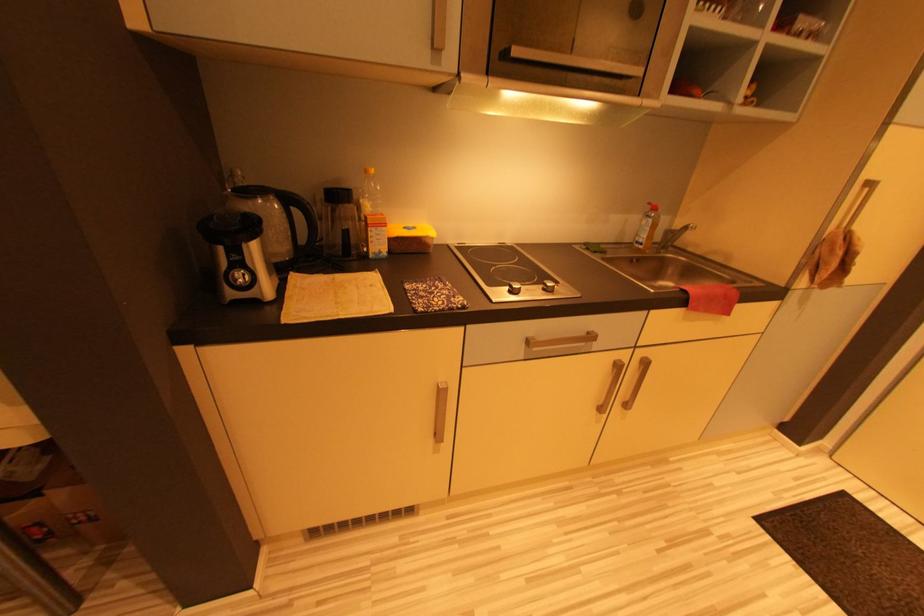
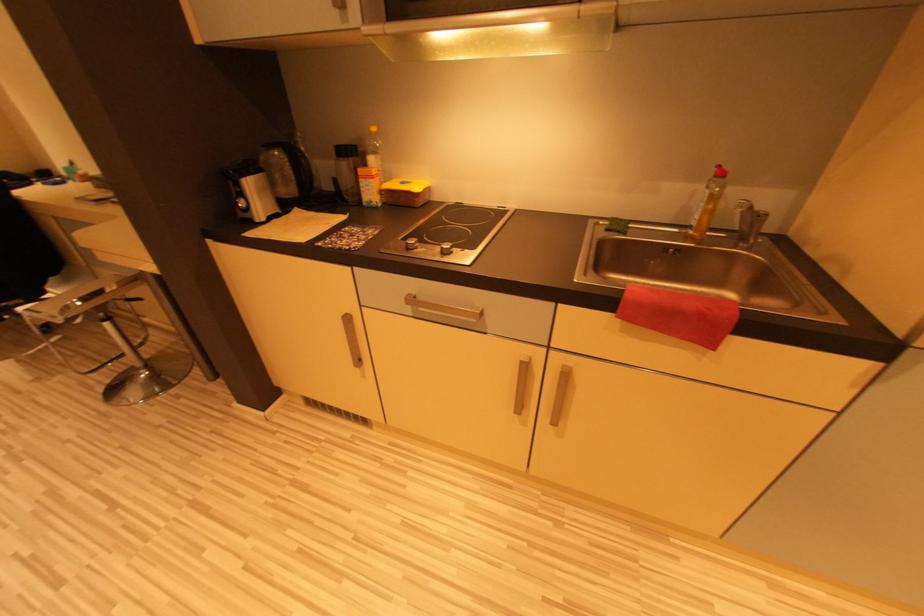
Question: The first image is from the beginning of the video and the second image is from the end. How did the camera likely rotate when shooting the video?

Choices:
 (A) Left
 (B) Right
 (C) Up
 (D) Down

Answer: (A)